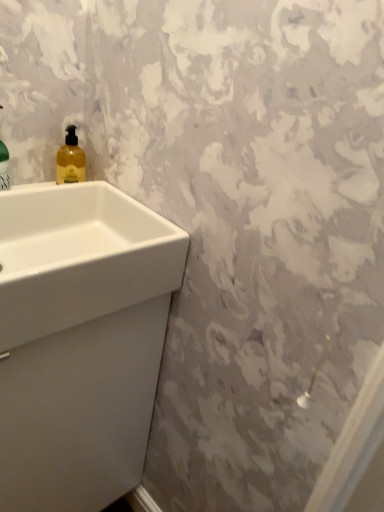
Question: Should I look upward or downward to see white glossy sink at lower left, the second sink viewed from the top?

Choices:
 (A) up
 (B) down

Answer: (B)

Question: Is white glossy sink at lower left, the first sink when ordered from bottom to top, not within white glossy sink at left, acting as the second sink starting from the bottom?

Choices:
 (A) no
 (B) yes

Answer: (B)

Question: Does white glossy sink at lower left, the first sink when ordered from bottom to top, have a lesser height compared to white glossy sink at left, the first sink in the top-to-bottom sequence?

Choices:
 (A) yes
 (B) no

Answer: (B)

Question: Does white glossy sink at lower left, the first sink when ordered from bottom to top, turn towards white glossy sink at left, the first sink in the top-to-bottom sequence?

Choices:
 (A) yes
 (B) no

Answer: (B)

Question: Are white glossy sink at lower left, the second sink viewed from the top, and white glossy sink at left, the first sink in the top-to-bottom sequence, making contact?

Choices:
 (A) no
 (B) yes

Answer: (B)

Question: Considering the relative sizes of white glossy sink at lower left, the second sink viewed from the top, and white glossy sink at left, the first sink in the top-to-bottom sequence, in the image provided, is white glossy sink at lower left, the second sink viewed from the top, bigger than white glossy sink at left, the first sink in the top-to-bottom sequence,?

Choices:
 (A) no
 (B) yes

Answer: (B)

Question: From the image's perspective, is white glossy sink at lower left, the second sink viewed from the top, located above white glossy sink at left, acting as the second sink starting from the bottom?

Choices:
 (A) yes
 (B) no

Answer: (B)

Question: Does yellow translucent liquid at upper left have a smaller size compared to white glossy sink at left, acting as the second sink starting from the bottom?

Choices:
 (A) yes
 (B) no

Answer: (A)

Question: Considering the relative positions of yellow translucent liquid at upper left and white glossy sink at left, the first sink in the top-to-bottom sequence, in the image provided, is yellow translucent liquid at upper left in front of white glossy sink at left, the first sink in the top-to-bottom sequence,?

Choices:
 (A) no
 (B) yes

Answer: (A)

Question: From the image's perspective, is yellow translucent liquid at upper left below white glossy sink at left, the first sink in the top-to-bottom sequence?

Choices:
 (A) yes
 (B) no

Answer: (B)

Question: Considering the relative positions of yellow translucent liquid at upper left and white glossy sink at left, the first sink in the top-to-bottom sequence, in the image provided, is yellow translucent liquid at upper left to the right of white glossy sink at left, the first sink in the top-to-bottom sequence, from the viewer's perspective?

Choices:
 (A) no
 (B) yes

Answer: (B)

Question: Does yellow translucent liquid at upper left turn towards white glossy sink at left, acting as the second sink starting from the bottom?

Choices:
 (A) no
 (B) yes

Answer: (A)

Question: From the image's perspective, is yellow translucent liquid at upper left on top of white glossy sink at left, acting as the second sink starting from the bottom?

Choices:
 (A) yes
 (B) no

Answer: (A)

Question: Can you confirm if white glossy sink at lower left, the first sink when ordered from bottom to top, is wider than yellow translucent liquid at upper left?

Choices:
 (A) yes
 (B) no

Answer: (A)